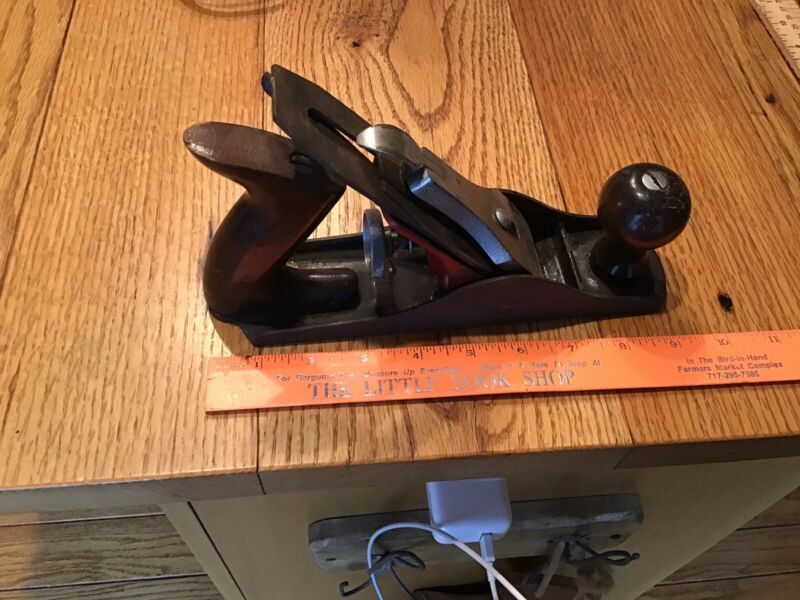
Where is `drawer`? The width and height of the screenshot is (800, 600). drawer is located at coordinates (212, 565).